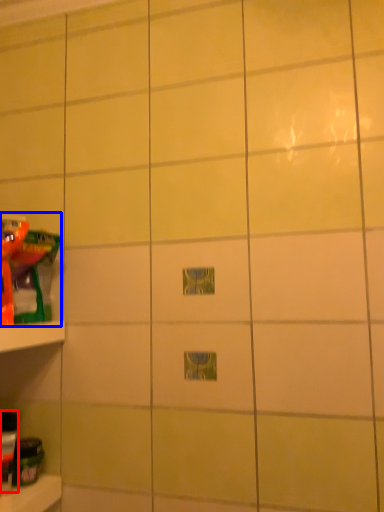
Question: Which of the following is the farthest to the observer, toy (highlighted by a red box) or toy (highlighted by a blue box)?

Choices:
 (A) toy
 (B) toy

Answer: (B)